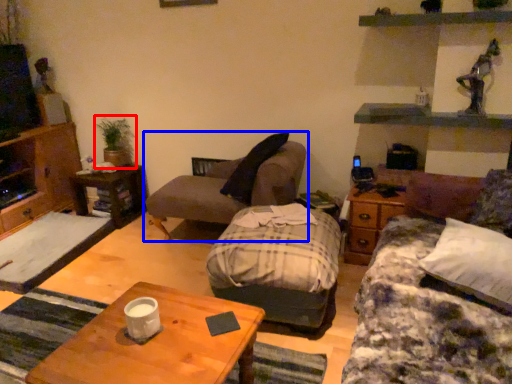
Question: Among these objects, which one is nearest to the camera, houseplant (highlighted by a red box) or chair (highlighted by a blue box)?

Choices:
 (A) houseplant
 (B) chair

Answer: (B)